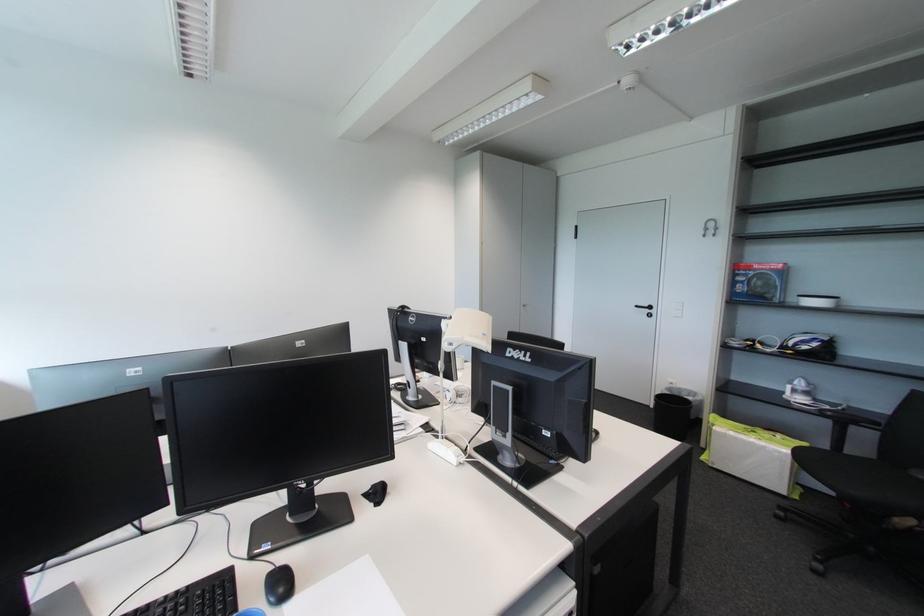
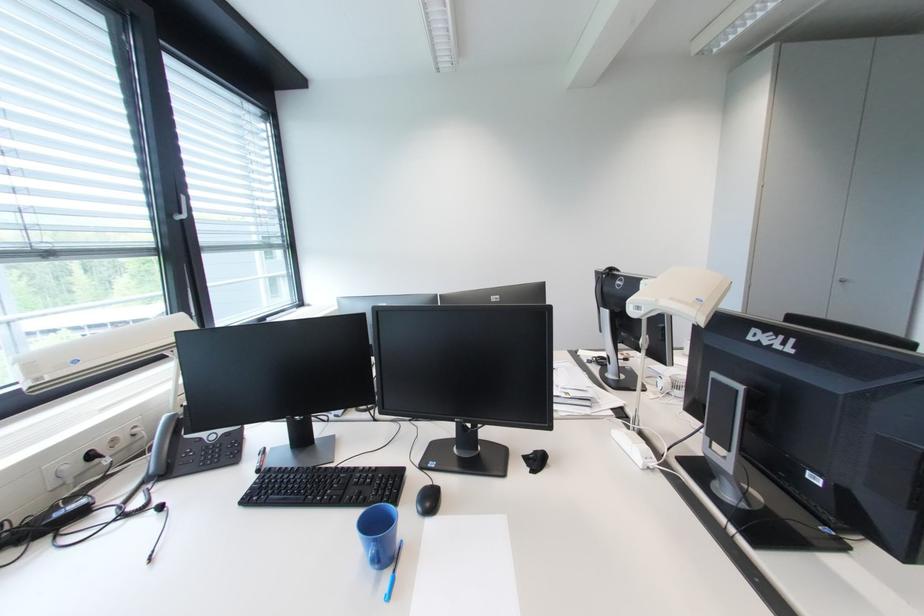
Question: How did the camera likely rotate?

Choices:
 (A) Left
 (B) Right
 (C) Up
 (D) Down

Answer: (A)